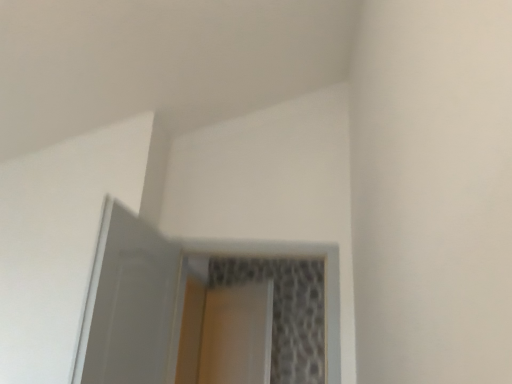
Question: Is clear glass screen door at center, acting as the 1th screen door starting from the back, spatially inside white glossy door at upper left, which is the first screen door in front-to-back order, or outside of it?

Choices:
 (A) inside
 (B) outside

Answer: (B)

Question: Considering the positions of clear glass screen door at center, the 2th screen door viewed from the front, and white glossy door at upper left, which is the first screen door in front-to-back order, in the image, is clear glass screen door at center, the 2th screen door viewed from the front, bigger or smaller than white glossy door at upper left, which is the first screen door in front-to-back order,?

Choices:
 (A) small
 (B) big

Answer: (A)

Question: Looking at their shapes, would you say clear glass screen door at center, the 2th screen door viewed from the front, is wider or thinner than white glossy door at upper left, acting as the second screen door starting from the back?

Choices:
 (A) thin
 (B) wide

Answer: (A)

Question: Considering the positions of point (173, 258) and point (228, 317), is point (173, 258) closer or farther from the camera than point (228, 317)?

Choices:
 (A) farther
 (B) closer

Answer: (B)

Question: Which is correct: white glossy door at upper left, which is the first screen door in front-to-back order, is inside clear glass screen door at center, the 2th screen door viewed from the front, or outside of it?

Choices:
 (A) inside
 (B) outside

Answer: (B)

Question: Looking at the image, does white glossy door at upper left, acting as the second screen door starting from the back, seem bigger or smaller compared to clear glass screen door at center, the 2th screen door viewed from the front?

Choices:
 (A) big
 (B) small

Answer: (A)

Question: Looking at their shapes, would you say white glossy door at upper left, acting as the second screen door starting from the back, is wider or thinner than clear glass screen door at center, acting as the 1th screen door starting from the back?

Choices:
 (A) thin
 (B) wide

Answer: (B)